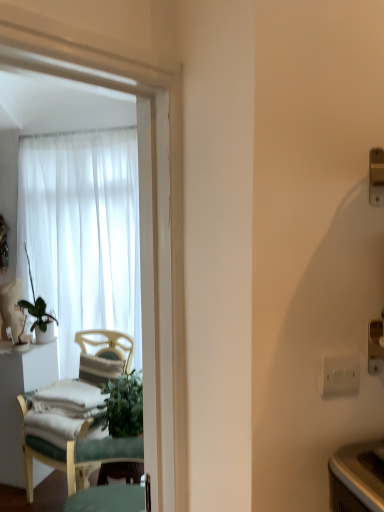
Find the location of a particular element. The image size is (384, 512). green leafy plant at left is located at coordinates [40, 320].

Measure the distance between green leafy plant at left and camera.

The distance of green leafy plant at left from camera is 2.92 meters.

In order to click on white sheer curtain at upper left in this screenshot , I will do `click(82, 233)`.

Find the location of a particular element. This screenshot has height=512, width=384. white plastic electric outlet at right is located at coordinates [339, 375].

Would you say green fabric chair at left is part of green leafy plant at left's contents?

No.

The width and height of the screenshot is (384, 512). I want to click on houseplant behind the green fabric chair at left, so click(x=40, y=320).

From the image's perspective, does green leafy plant at left appear higher than green fabric chair at left?

Correct, green leafy plant at left appears higher than green fabric chair at left in the image.

Does point (44, 331) come in front of point (29, 455)?

No, (44, 331) is further to viewer.

Considering the points (87, 480) and (9, 349), which point is in front, point (87, 480) or point (9, 349)?

The point (87, 480) is in front.

From a real-world perspective, which is physically below, green fabric chair at left or white fabric desk at left?

From a 3D spatial view, white fabric desk at left is below.

Does green fabric chair at left have a lesser height compared to white fabric desk at left?

No, green fabric chair at left is not shorter than white fabric desk at left.

Considering the relative positions of green fabric chair at left and white fabric desk at left in the image provided, is green fabric chair at left to the left or to the right of white fabric desk at left?

green fabric chair at left is positioned on white fabric desk at left's right side.

Does white fabric desk at left turn towards green leafy plant at left?

No.

From the image's perspective, which one is positioned lower, white fabric desk at left or green leafy plant at left?

white fabric desk at left is shown below in the image.

Which is more distant, (22, 417) or (32, 330)?

The point (32, 330) is farther.

This screenshot has height=512, width=384. What are the coordinates of `desk located on the left of green leafy plant at left` in the screenshot? It's located at (17, 402).

Does green fabric chair at left contain white plastic electric outlet at right?

No, white plastic electric outlet at right is not inside green fabric chair at left.

Considering the relative sizes of green fabric chair at left and white plastic electric outlet at right in the image provided, is green fabric chair at left shorter than white plastic electric outlet at right?

No, green fabric chair at left is not shorter than white plastic electric outlet at right.

Between green fabric chair at left and white plastic electric outlet at right, which one has larger width?

green fabric chair at left.

Considering the positions of point (86, 330) and point (336, 365), is point (86, 330) closer or farther from the camera than point (336, 365)?

Clearly, point (86, 330) is more distant from the camera than point (336, 365).

From a real-world perspective, is white sheer curtain at upper left above or below green fabric chair at left?

white sheer curtain at upper left is above green fabric chair at left.

Locate an element on the screen. chair that is in front of the white sheer curtain at upper left is located at coordinates click(x=66, y=456).

Who is more distant, white sheer curtain at upper left or green fabric chair at left?

white sheer curtain at upper left is behind.

Is white sheer curtain at upper left thinner than white plastic electric outlet at right?

In fact, white sheer curtain at upper left might be wider than white plastic electric outlet at right.

Can you tell me how much white sheer curtain at upper left and white plastic electric outlet at right differ in facing direction?

There is a 2.31-degree angle between the facing directions of white sheer curtain at upper left and white plastic electric outlet at right.

From a real-world perspective, relative to white plastic electric outlet at right, is white sheer curtain at upper left vertically above or below?

Clearly, from a real-world perspective, white sheer curtain at upper left is above white plastic electric outlet at right.

Is white sheer curtain at upper left facing towards white plastic electric outlet at right?

Yes, white sheer curtain at upper left is aimed at white plastic electric outlet at right.

Is white fabric desk at left far away from white sheer curtain at upper left?

Answer: No, there isn't a large distance between white fabric desk at left and white sheer curtain at upper left.

Is white fabric desk at left not within white sheer curtain at upper left?

Yes, white fabric desk at left is located beyond the bounds of white sheer curtain at upper left.

What's the angular difference between white fabric desk at left and white sheer curtain at upper left's facing directions?

The facing directions of white fabric desk at left and white sheer curtain at upper left are 29.8 degrees apart.

The image size is (384, 512). Find the location of `chair that is in front of the green leafy plant at left`. chair that is in front of the green leafy plant at left is located at coordinates (66, 456).

Where is `chair above the white fabric desk at left (from the image's perspective)`? chair above the white fabric desk at left (from the image's perspective) is located at coordinates (66, 456).

When comparing their distances from green fabric chair at left, does white fabric desk at left or white sheer curtain at upper left seem closer?

white fabric desk at left is positioned closer to the anchor green fabric chair at left.

Looking at the image, which one is located closer to white sheer curtain at upper left, green fabric chair at left or green leafy plant at left?

green leafy plant at left.

From the image, which object appears to be farther from white sheer curtain at upper left, green leafy plant at left or white fabric desk at left?

white fabric desk at left is positioned further to the anchor white sheer curtain at upper left.

When comparing their distances from green leafy plant at left, does green fabric chair at left or white sheer curtain at upper left seem closer?

white sheer curtain at upper left.

Looking at the image, which one is located further to green fabric chair at left, white fabric desk at left or green leafy plant at left?

green leafy plant at left.

From the picture: Based on their spatial positions, is white plastic electric outlet at right or green leafy plant at left further from white sheer curtain at upper left?

Among the two, white plastic electric outlet at right is located further to white sheer curtain at upper left.

Looking at the image, which one is located closer to green leafy plant at left, white fabric desk at left or white plastic electric outlet at right?

Based on the image, white fabric desk at left appears to be nearer to green leafy plant at left.

From the picture: Estimate the real-world distances between objects in this image. Which object is further from white sheer curtain at upper left, white fabric desk at left or white plastic electric outlet at right?

The object further to white sheer curtain at upper left is white plastic electric outlet at right.

Identify the location of chair between green leafy plant at left and white fabric desk at left vertically. Image resolution: width=384 pixels, height=512 pixels. (66, 456).

You are a GUI agent. You are given a task and a screenshot of the screen. Output one action in this format:
    pyautogui.click(x=<x>, y=<y>)
    Task: Click on the chair that lies between white sheer curtain at upper left and white fabric desk at left from top to bottom
    Image resolution: width=384 pixels, height=512 pixels.
    Given the screenshot: What is the action you would take?
    pyautogui.click(x=66, y=456)

Identify the location of houseplant between white sheer curtain at upper left and green fabric chair at left from top to bottom. The height and width of the screenshot is (512, 384). (40, 320).

I want to click on desk between white plastic electric outlet at right and green leafy plant at left in the front-back direction, so click(x=17, y=402).